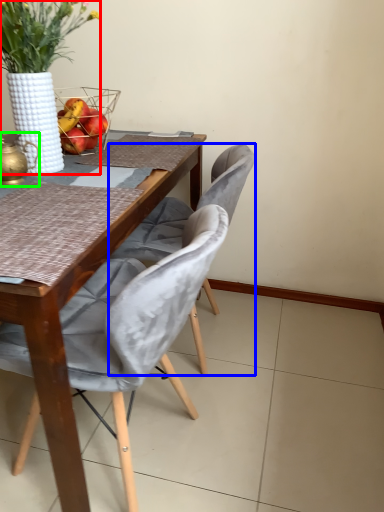
Question: Based on their relative distances, which object is farther from houseplant (highlighted by a red box)? Choose from chair (highlighted by a blue box) and tea pot (highlighted by a green box).

Choices:
 (A) chair
 (B) tea pot

Answer: (A)